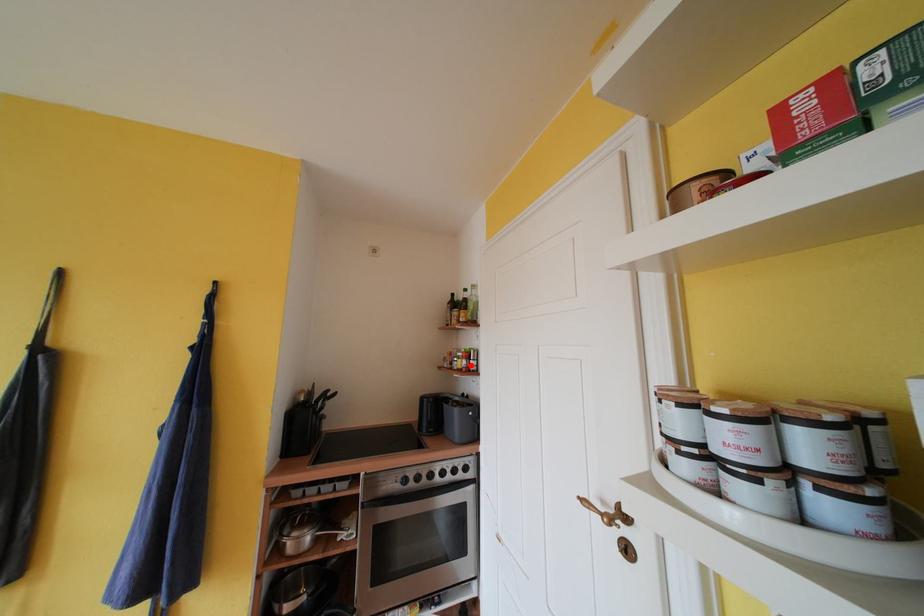
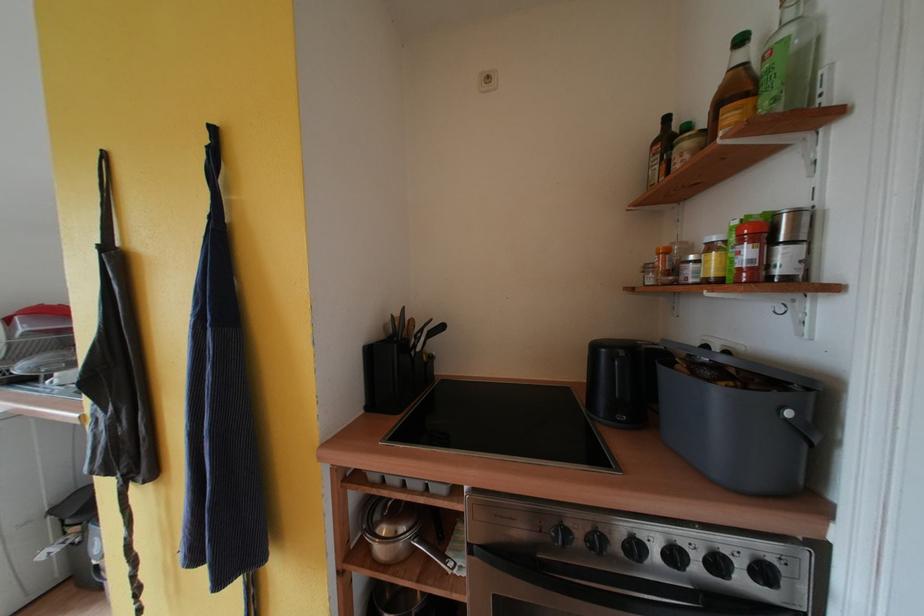
Locate, in the second image, the point that corresponds to the highlighted location in the first image.

(755, 256)